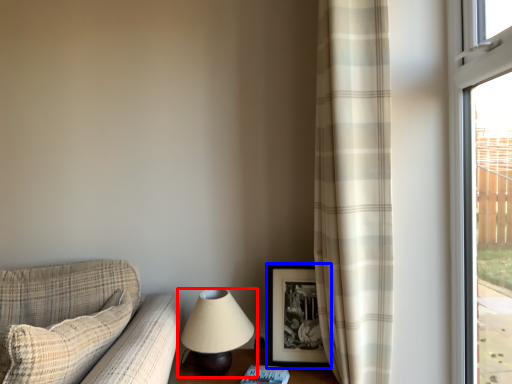
Question: Which object appears farthest to the camera in this image, lamp (highlighted by a red box) or picture frame (highlighted by a blue box)?

Choices:
 (A) lamp
 (B) picture frame

Answer: (B)